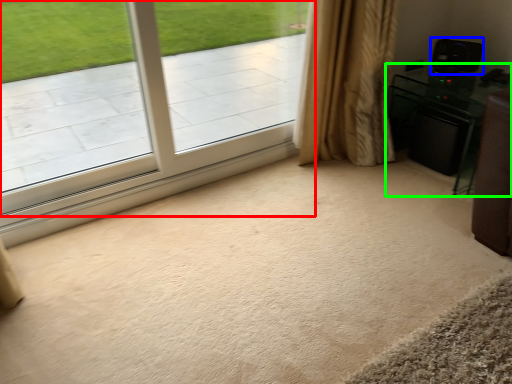
Question: Based on their relative distances, which object is nearer to window (highlighted by a red box)? Choose from speaker (highlighted by a blue box) and furniture (highlighted by a green box).

Choices:
 (A) speaker
 (B) furniture

Answer: (B)